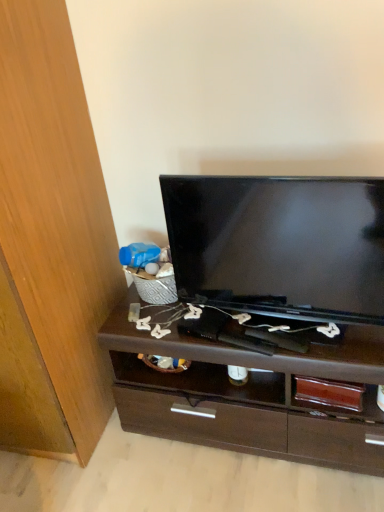
Identify the location of black glossy television at center. The width and height of the screenshot is (384, 512). (279, 244).

Which is in front, point (124, 407) or point (306, 218)?

The point (306, 218) is closer.

From the picture: Which is more to the right, dark brown wood chest of drawers at center or black glossy television at center?

black glossy television at center.

Between dark brown wood chest of drawers at center and black glossy television at center, which one is positioned in front?

black glossy television at center is closer to the camera.

Which is more to the right, wooden cabinet at left or black glossy television at center?

black glossy television at center is more to the right.

Considering the sizes of objects wooden cabinet at left and black glossy television at center in the image provided, who is bigger, wooden cabinet at left or black glossy television at center?

wooden cabinet at left.

Is wooden cabinet at left positioned with its back to black glossy television at center?

No, wooden cabinet at left's orientation is not away from black glossy television at center.

From a real-world perspective, is dark brown wood chest of drawers at center physically located above or below wooden cabinet at left?

dark brown wood chest of drawers at center is situated lower than wooden cabinet at left in the real world.

Considering the sizes of objects dark brown wood chest of drawers at center and wooden cabinet at left in the image provided, who is shorter, dark brown wood chest of drawers at center or wooden cabinet at left?

With less height is dark brown wood chest of drawers at center.

Which object is closer to the camera, dark brown wood chest of drawers at center or wooden cabinet at left?

wooden cabinet at left is more forward.

From the picture: Who is bigger, dark brown wood chest of drawers at center or wooden cabinet at left?

Bigger between the two is wooden cabinet at left.

Consider the image. Between wooden cabinet at left and dark brown wood chest of drawers at center, which one appears on the left side from the viewer's perspective?

wooden cabinet at left is more to the left.

Are wooden cabinet at left and dark brown wood chest of drawers at center making contact?

No, wooden cabinet at left is not touching dark brown wood chest of drawers at center.

Based on the photo, who is more distant, wooden cabinet at left or dark brown wood chest of drawers at center?

dark brown wood chest of drawers at center.

Can you confirm if wooden cabinet at left is shorter than dark brown wood chest of drawers at center?

No.

From a real-world perspective, is black glossy television at center physically above dark brown wood chest of drawers at center?

Yes.

You are a GUI agent. You are given a task and a screenshot of the screen. Output one action in this format:
    pyautogui.click(x=<x>, y=<y>)
    Task: Click on the chest of drawers below the black glossy television at center (from a real-world perspective)
    
    Given the screenshot: What is the action you would take?
    pyautogui.click(x=250, y=395)

Is black glossy television at center spatially inside dark brown wood chest of drawers at center, or outside of it?

The correct answer is: outside.

You are a GUI agent. You are given a task and a screenshot of the screen. Output one action in this format:
    pyautogui.click(x=<x>, y=<y>)
    Task: Click on the cabinetry located underneath the black glossy television at center (from a real-world perspective)
    The height and width of the screenshot is (512, 384).
    Given the screenshot: What is the action you would take?
    pyautogui.click(x=51, y=242)

Can you confirm if black glossy television at center is taller than wooden cabinet at left?

Incorrect, the height of black glossy television at center is not larger of that of wooden cabinet at left.

Which of these two, black glossy television at center or wooden cabinet at left, is smaller?

black glossy television at center is smaller.

From the image's perspective, is black glossy television at center located above or below wooden cabinet at left?

Based on their image positions, black glossy television at center is located beneath wooden cabinet at left.

The image size is (384, 512). I want to click on television in front of the dark brown wood chest of drawers at center, so click(279, 244).

Identify the location of cabinetry above the black glossy television at center (from the image's perspective). 51,242.

Looking at the image, which one is located closer to wooden cabinet at left, black glossy television at center or dark brown wood chest of drawers at center?

Based on the image, dark brown wood chest of drawers at center appears to be nearer to wooden cabinet at left.

Based on their spatial positions, is wooden cabinet at left or dark brown wood chest of drawers at center closer to black glossy television at center?

The object closer to black glossy television at center is dark brown wood chest of drawers at center.

Estimate the real-world distances between objects in this image. Which object is closer to dark brown wood chest of drawers at center, black glossy television at center or wooden cabinet at left?

black glossy television at center.

When comparing their distances from dark brown wood chest of drawers at center, does wooden cabinet at left or black glossy television at center seem closer?

Among the two, black glossy television at center is located nearer to dark brown wood chest of drawers at center.

Which object lies further to the anchor point black glossy television at center, dark brown wood chest of drawers at center or wooden cabinet at left?

The object further to black glossy television at center is wooden cabinet at left.

Estimate the real-world distances between objects in this image. Which object is further from wooden cabinet at left, dark brown wood chest of drawers at center or black glossy television at center?

The object further to wooden cabinet at left is black glossy television at center.

The height and width of the screenshot is (512, 384). Identify the location of the chest of drawers situated between wooden cabinet at left and black glossy television at center from left to right. (250, 395).